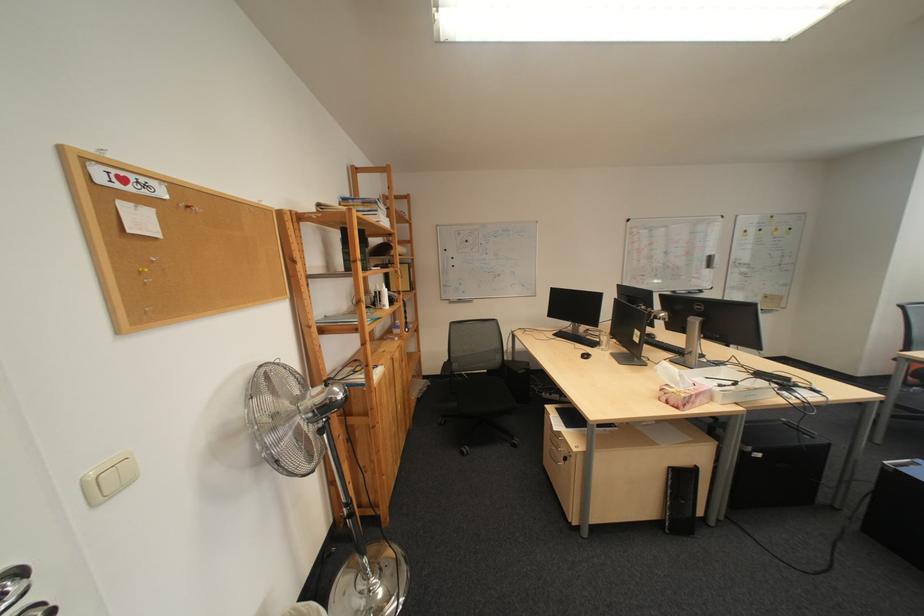
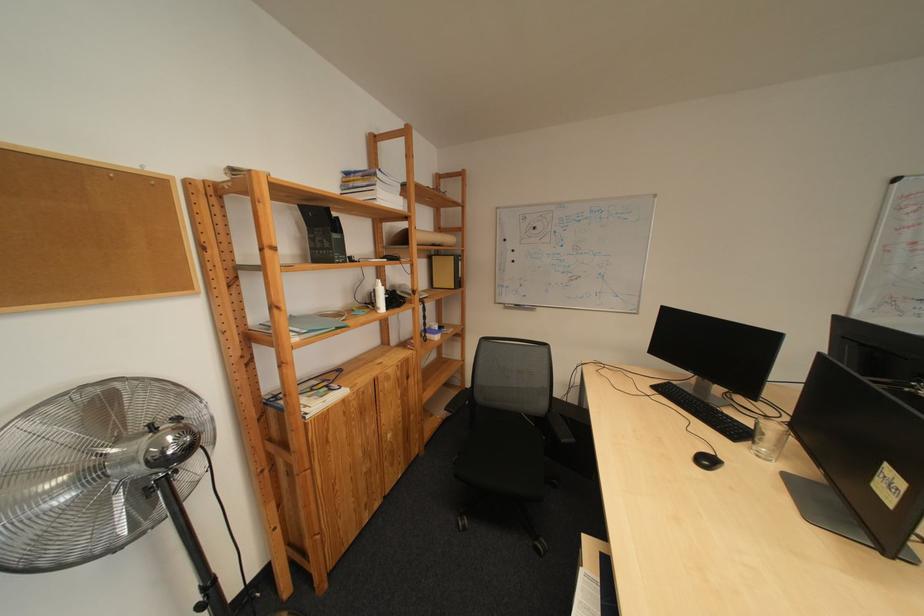
Question: The first image is from the beginning of the video and the second image is from the end. How did the camera likely rotate when shooting the video?

Choices:
 (A) Left
 (B) Right
 (C) Up
 (D) Down

Answer: (A)